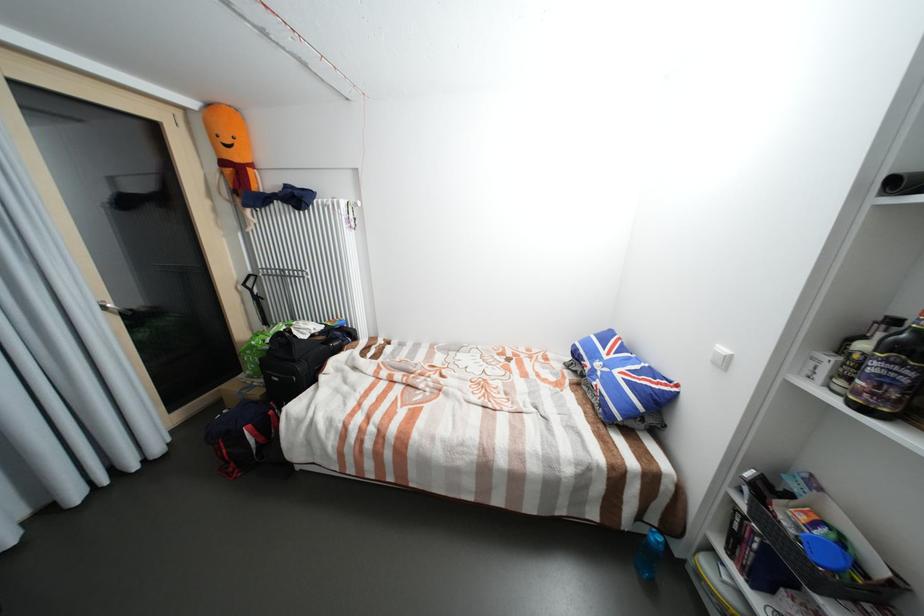
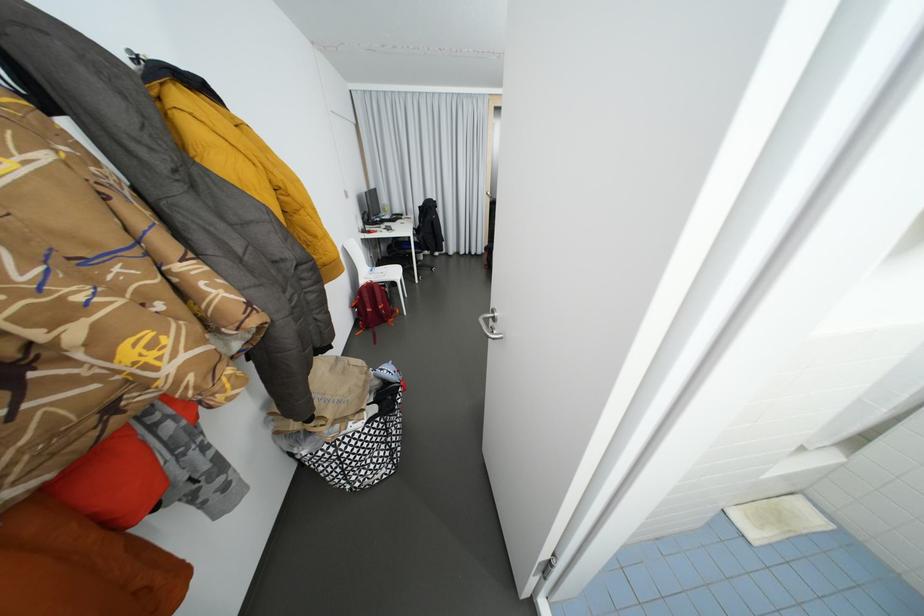
Question: I am providing you with two images of the same scene from different viewpoints. Please identify which objects are invisible in image2.

Choices:
 (A) white chair sitting surface
 (B) red backpack
 (C) orange cup
 (D) dark glass bottle

Answer: (D)